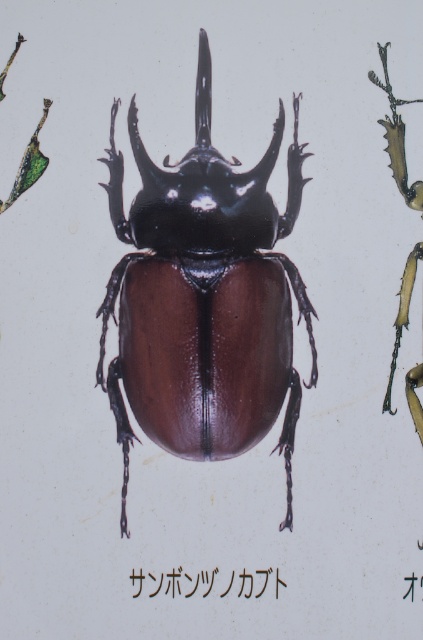
Between point (197, 296) and point (261, 586), which one is positioned in front?

Point (197, 296) is more forward.

Who is positioned more to the right, shiny brown beetle at center or black glossy beetle at center?

black glossy beetle at center is more to the right.

Which is behind, point (222, 426) or point (186, 589)?

Point (186, 589)

Where is `shiny brown beetle at center`? shiny brown beetle at center is located at coordinates point(205,298).